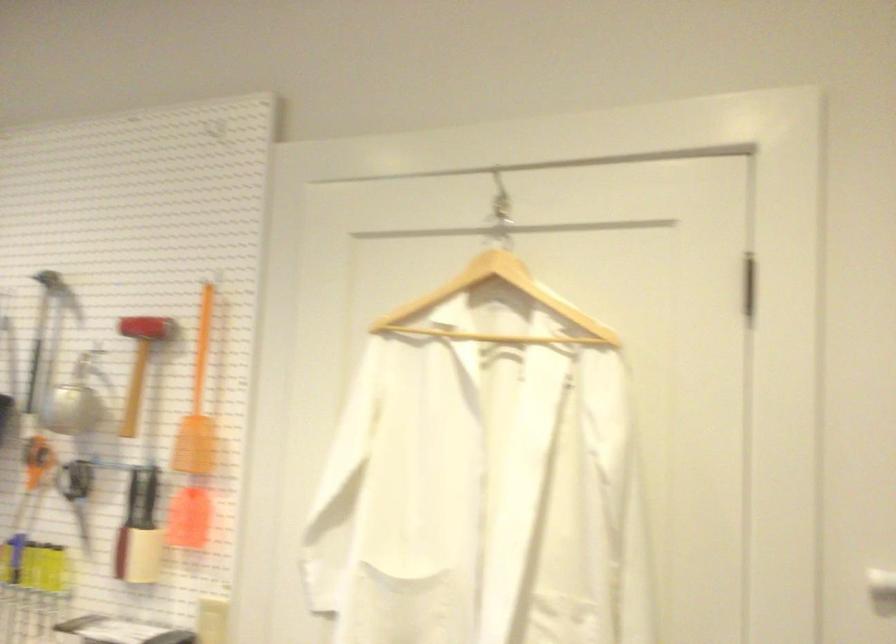
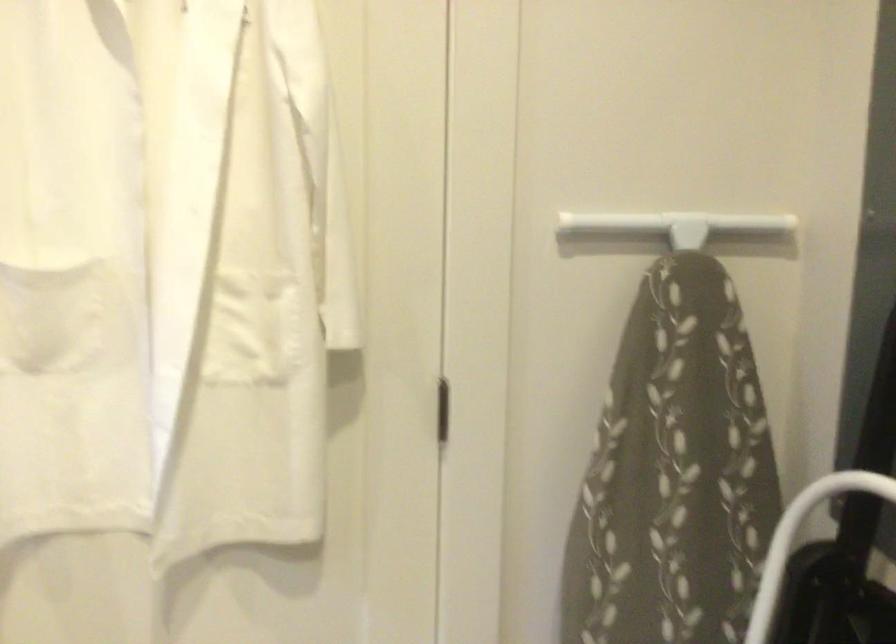
Question: The camera is either moving clockwise (left) or counter-clockwise (right) around the object. The first image is from the beginning of the video and the second image is from the end. Is the camera moving left or right when shooting the video?

Choices:
 (A) Left
 (B) Right

Answer: (A)